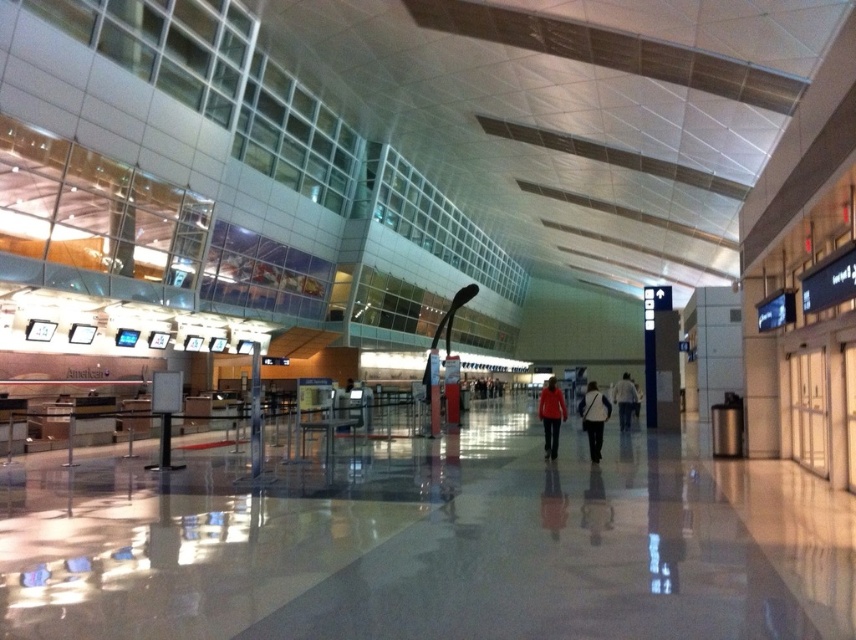
You are a traveler standing at the entrance of the airport terminal. You see a white fabric bag at center and a matte red jacket at center. Which item is bigger in size?

The white fabric bag at center is larger in size than the matte red jacket at center.

You are standing in the airport terminal and want to walk towards the point marked at coordinates [595,403]. How far will you have to walk to reach that point?

The point at coordinates [595,403] is 13.00 meters away from you, so you will have to walk 13.00 meters to reach it.